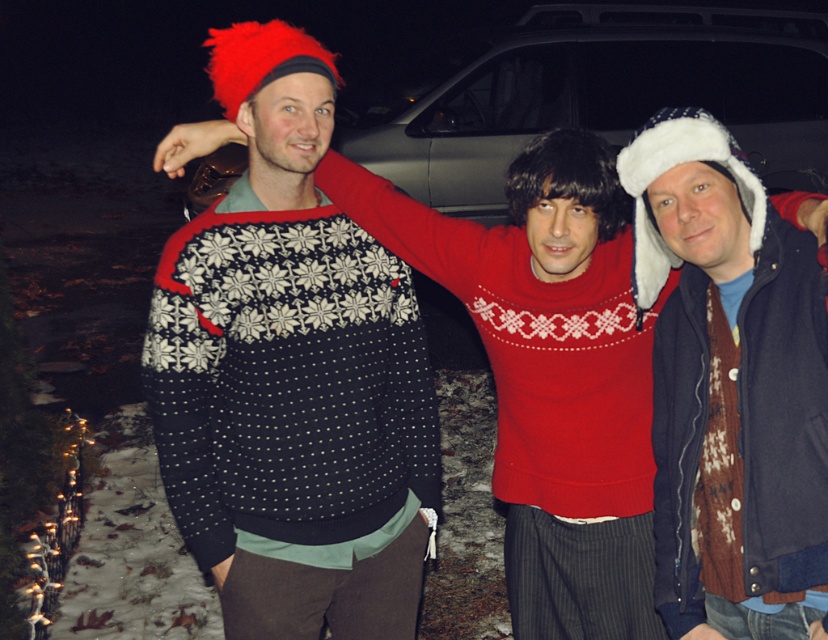
Is knitted wool sweater at center positioned in front of metallic silver car at center?

Yes, it is.

This screenshot has width=828, height=640. Find the location of `knitted wool sweater at center`. knitted wool sweater at center is located at coordinates (730, 387).

Image resolution: width=828 pixels, height=640 pixels. Find the location of `knitted wool sweater at center`. knitted wool sweater at center is located at coordinates (730, 387).

Is knitted sweater at center above metallic silver car at center?

No, knitted sweater at center is not above metallic silver car at center.

Between point (302, 65) and point (395, 120), which one is positioned behind?

The point (395, 120) is behind.

Is point (407, 461) more distant than point (643, 92)?

No.

What are the coordinates of `knitted sweater at center` in the screenshot? It's located at (291, 374).

Which is in front, point (360, 365) or point (701, 358)?

Point (701, 358) is more forward.

What do you see at coordinates (291, 374) in the screenshot? This screenshot has width=828, height=640. I see `knitted sweater at center` at bounding box center [291, 374].

Is point (292, 444) more distant than point (792, 317)?

That is True.

Locate an element on the screen. Image resolution: width=828 pixels, height=640 pixels. knitted sweater at center is located at coordinates (291, 374).